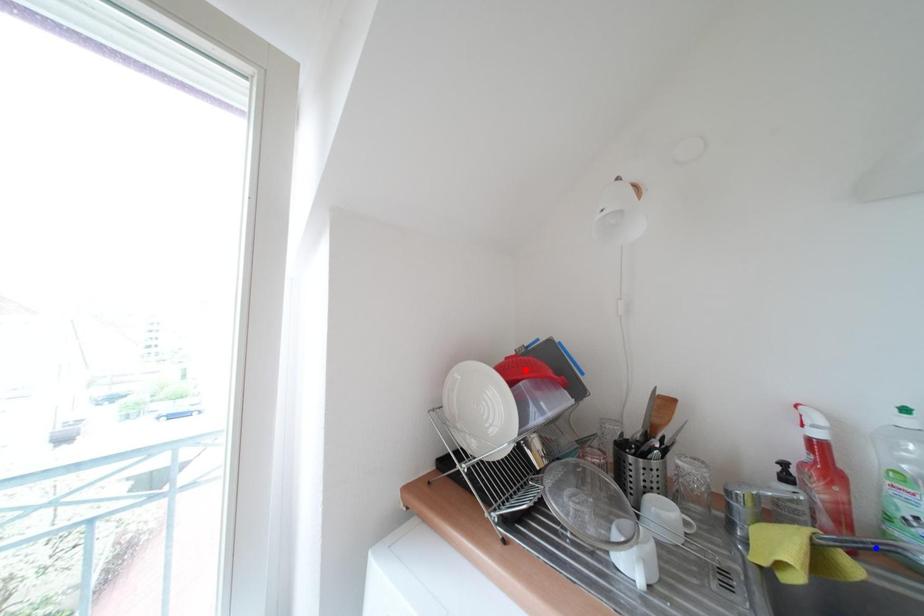
Question: Two points are marked on the image. Which point is closer to the camera?

Choices:
 (A) Blue point is closer.
 (B) Red point is closer.

Answer: (A)